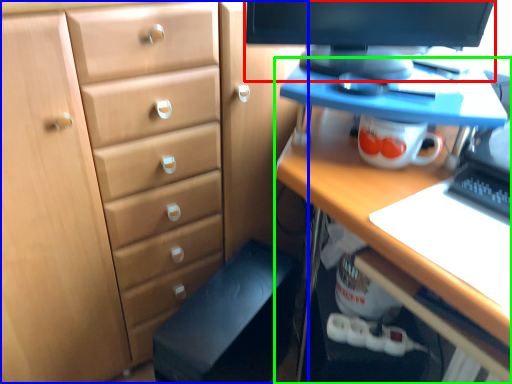
Question: Considering the real-world distances, which object is closest to computer monitor (highlighted by a red box)? chest of drawers (highlighted by a blue box) or desk (highlighted by a green box).

Choices:
 (A) chest of drawers
 (B) desk

Answer: (B)